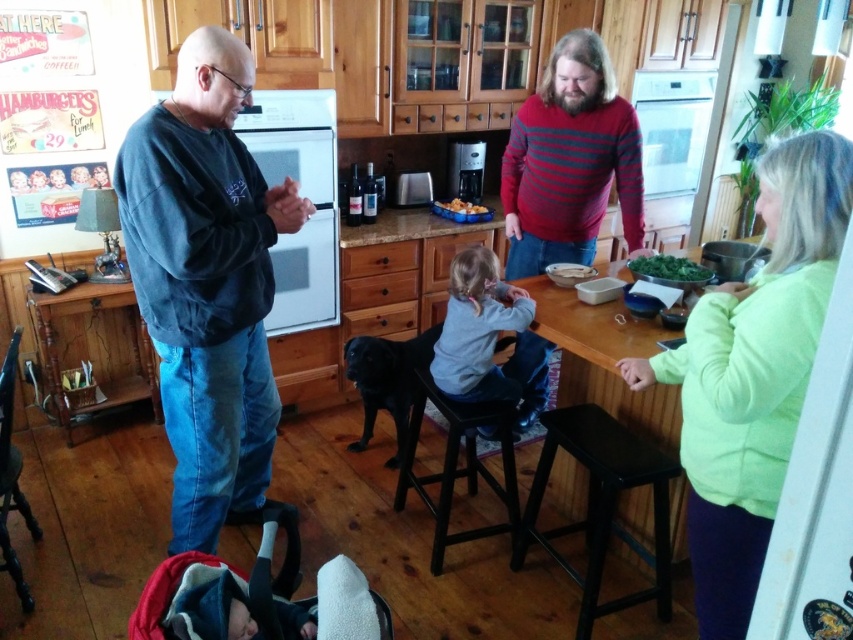
In the kitchen scene, there is a green leafy vegetable at center and a golden brown crispy chicken at center. From the perspective of someone standing at the counter where the older man is, which item is positioned to the right?

The green leafy vegetable at center is to the right of the golden brown crispy chicken at center, so from the older man standing at the counter, the green leafy vegetable at center would be on his right side.

You are organizing a small gathering in the kitchen. You need to place a decorative centerpiece on the wooden table at center. However, there is a green fleece jacket at upper right nearby. Considering their sizes, will the jacket interfere with placing the centerpiece on the table?

The green fleece jacket at upper right has a smaller size compared to the wooden table at center, so it is unlikely to interfere with placing the centerpiece on the wooden table at center. Ensure the jacket is not on the table itself.